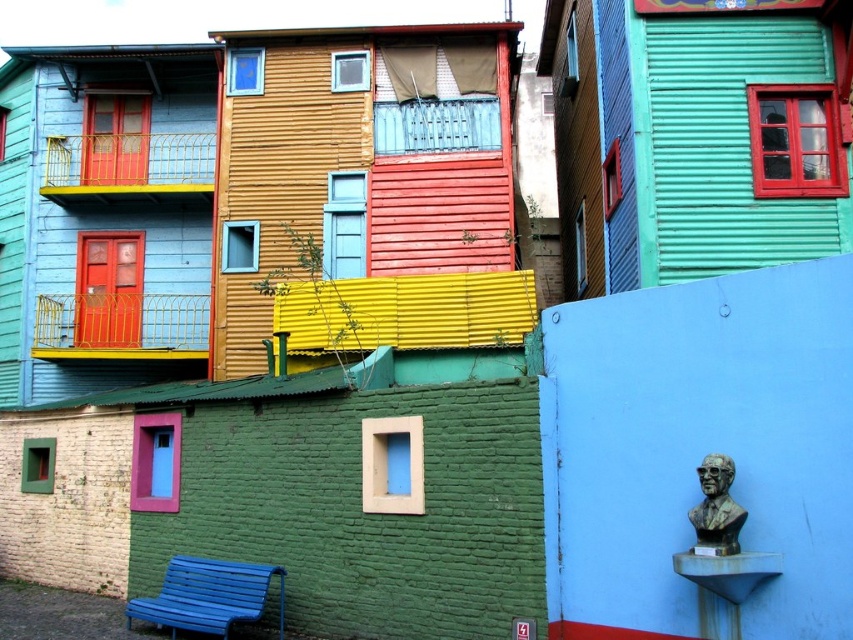
Question: Which object appears farthest from the camera in this image?

Choices:
 (A) bronze bust at right
 (B) blue painted wood bench at lower left

Answer: (B)

Question: Is blue painted wood bench at lower left thinner than bronze bust at right?

Choices:
 (A) yes
 (B) no

Answer: (B)

Question: Is blue painted wood bench at lower left thinner than bronze bust at right?

Choices:
 (A) no
 (B) yes

Answer: (A)

Question: Is blue painted wood bench at lower left to the left of bronze bust at right from the viewer's perspective?

Choices:
 (A) yes
 (B) no

Answer: (A)